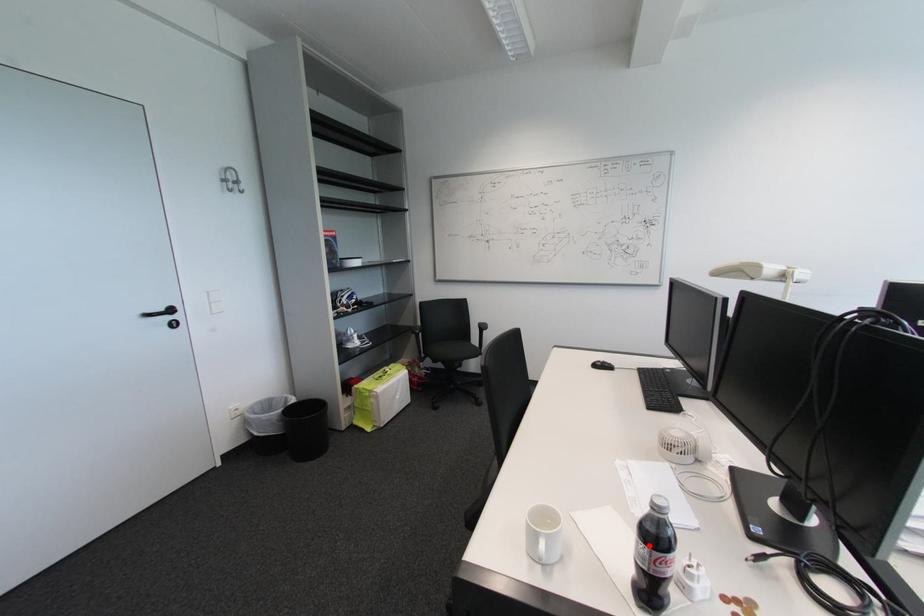
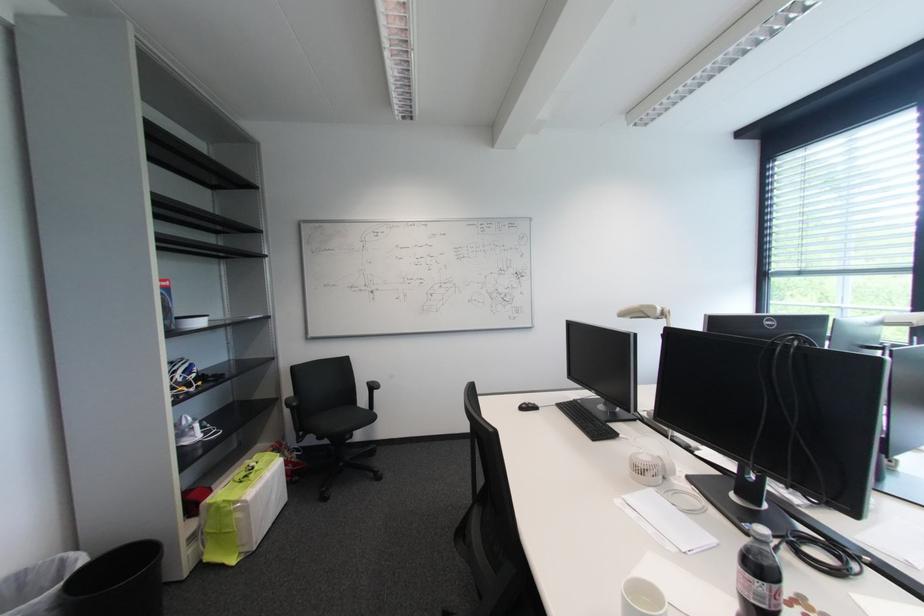
Question: A red point is marked in image1. In image2, is the corresponding 3D point closer to the camera or farther? Reply with the corresponding letter.

Choices:
 (A) The corresponding 3D point is closer.
 (B) The corresponding 3D point is farther.

Answer: (A)